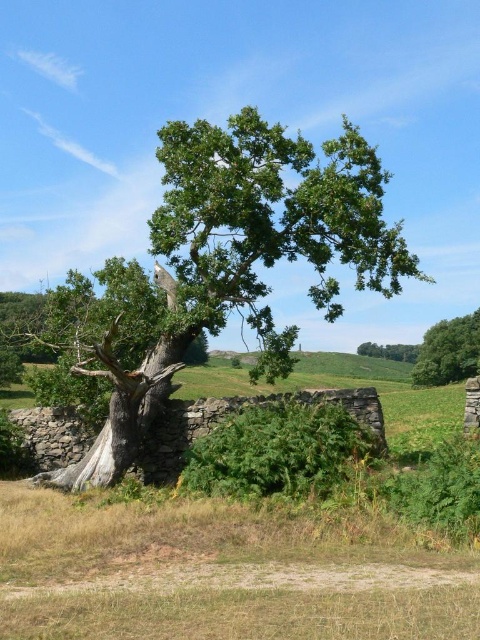
Can you confirm if green leafy oak tree at center is positioned to the right of green leafy tree at upper right?

In fact, green leafy oak tree at center is to the left of green leafy tree at upper right.

Image resolution: width=480 pixels, height=640 pixels. What are the coordinates of `green leafy oak tree at center` in the screenshot? It's located at (225, 266).